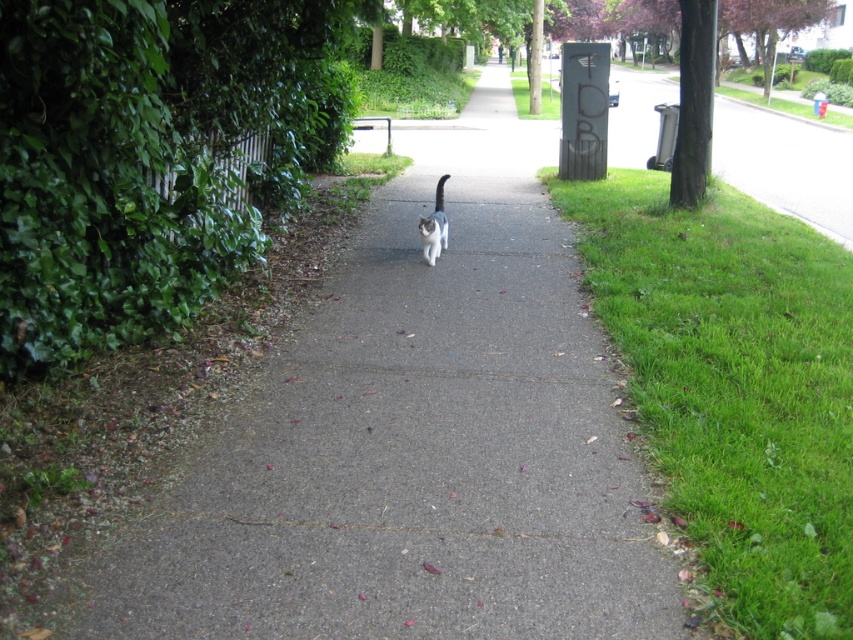
From the picture: You are a photographer aiming to capture the white fur cat at center and the green grass at lower right in the same frame. Which object will appear taller in the photo?

The white fur cat at center will appear taller in the photo since the green grass at lower right is shorter than it.

You are a photographer standing on the sidewalk and want to capture a photo of the white fur cat at center. To get the best shot, you need to ensure the green grass at lower right doesn not block the cat. Given their sizes, can you position yourself so that the grass is entirely out of frame while keeping the cat centered?

The green grass at lower right is wider than the white fur cat at center. Since the grass is wider, positioning yourself to exclude it while keeping the cat centered may be challenging unless you move closer to reduce the grass area in the frame.